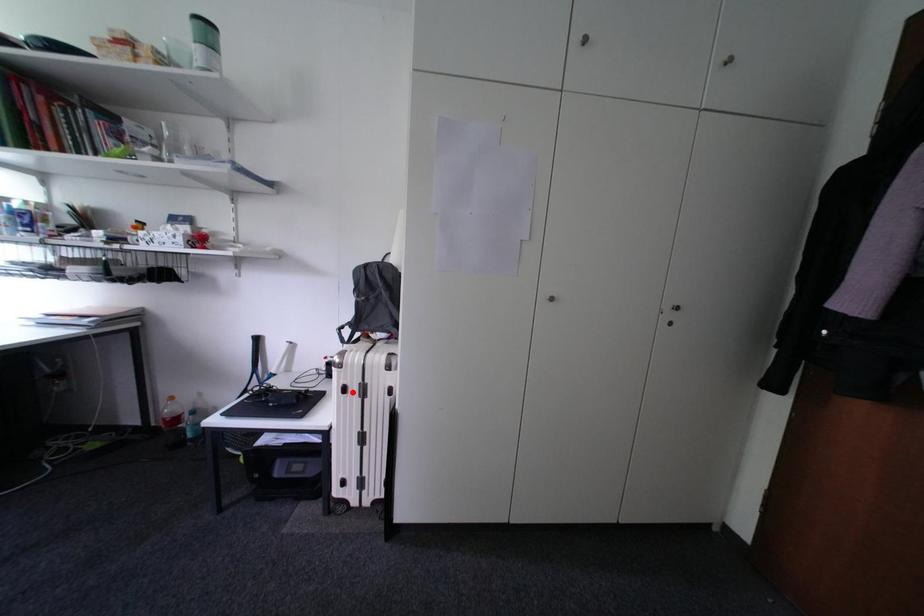
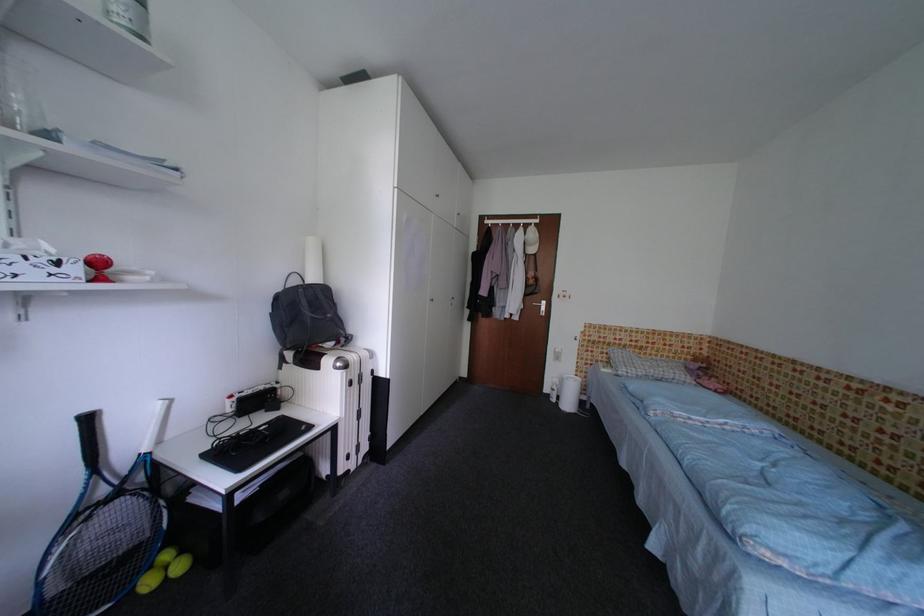
Locate, in the second image, the point that corresponds to the highlighted location in the first image.

(359, 386)